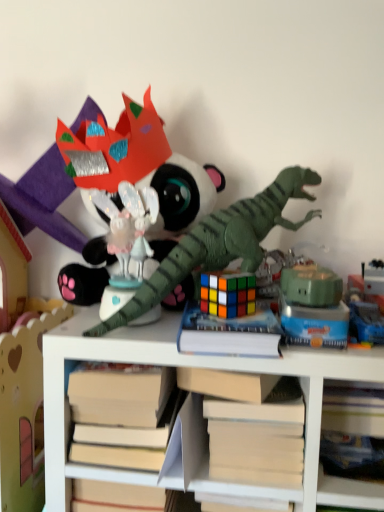
Question: Is green matte robot at center, arranged as the 3th toy when viewed from the right, positioned with its back to shiny plastic dragon at center, which is the sixth toy in right-to-left order?

Choices:
 (A) yes
 (B) no

Answer: (B)

Question: Can you confirm if green matte robot at center, which ranks as the fourth toy in left-to-right order, is positioned to the left of shiny plastic dragon at center, placed as the 1th toy when sorted from left to right?

Choices:
 (A) no
 (B) yes

Answer: (A)

Question: Considering the relative sizes of green matte robot at center, arranged as the 3th toy when viewed from the right, and shiny plastic dragon at center, placed as the 1th toy when sorted from left to right, in the image provided, is green matte robot at center, arranged as the 3th toy when viewed from the right, wider than shiny plastic dragon at center, placed as the 1th toy when sorted from left to right,?

Choices:
 (A) no
 (B) yes

Answer: (A)

Question: From a real-world perspective, is green matte robot at center, arranged as the 3th toy when viewed from the right, physically below shiny plastic dragon at center, placed as the 1th toy when sorted from left to right?

Choices:
 (A) yes
 (B) no

Answer: (A)

Question: Is green matte robot at center, which ranks as the fourth toy in left-to-right order, far from shiny plastic dragon at center, placed as the 1th toy when sorted from left to right?

Choices:
 (A) no
 (B) yes

Answer: (A)

Question: Visually, is green matte robot at center, arranged as the 3th toy when viewed from the right, positioned to the left or to the right of metallic silver toy at center, arranged as the first toy when viewed from the right?

Choices:
 (A) right
 (B) left

Answer: (B)

Question: Is green matte robot at center, arranged as the 3th toy when viewed from the right, in front of or behind metallic silver toy at center, arranged as the first toy when viewed from the right, in the image?

Choices:
 (A) front
 (B) behind

Answer: (A)

Question: Looking at the image, does green matte robot at center, arranged as the 3th toy when viewed from the right, seem bigger or smaller compared to metallic silver toy at center, arranged as the first toy when viewed from the right?

Choices:
 (A) small
 (B) big

Answer: (B)

Question: Is green matte robot at center, arranged as the 3th toy when viewed from the right, spatially inside metallic silver toy at center, arranged as the first toy when viewed from the right, or outside of it?

Choices:
 (A) outside
 (B) inside

Answer: (A)

Question: In terms of width, does shiny plastic dragon at center, which is the sixth toy in right-to-left order, look wider or thinner when compared to white matte book at center?

Choices:
 (A) thin
 (B) wide

Answer: (B)

Question: From their relative heights in the image, would you say shiny plastic dragon at center, placed as the 1th toy when sorted from left to right, is taller or shorter than white matte book at center?

Choices:
 (A) short
 (B) tall

Answer: (B)

Question: Based on their positions, is shiny plastic dragon at center, placed as the 1th toy when sorted from left to right, located to the left or right of white matte book at center?

Choices:
 (A) left
 (B) right

Answer: (A)

Question: Considering their positions, is shiny plastic dragon at center, which is the sixth toy in right-to-left order, located in front of or behind white matte book at center?

Choices:
 (A) behind
 (B) front

Answer: (A)

Question: Is hardcover book at center to the left or to the right of shiny plastic dragon at center, placed as the 1th toy when sorted from left to right, in the image?

Choices:
 (A) left
 (B) right

Answer: (B)

Question: Is point (218, 322) closer or farther from the camera than point (168, 222)?

Choices:
 (A) farther
 (B) closer

Answer: (B)